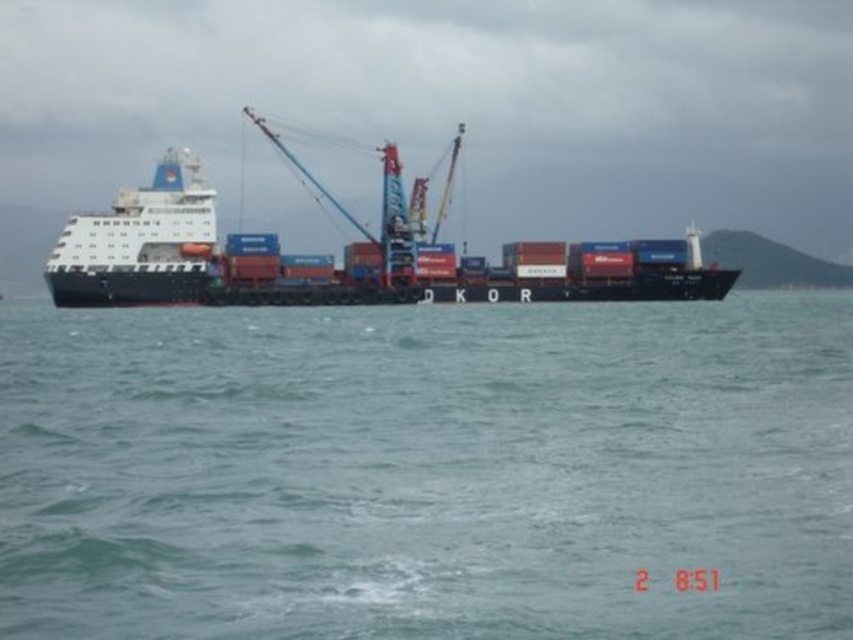
You are a sailor on the deck of the ship and looking straight ahead. Which object is closer to you between the blue water at center and the black matte container ship at center?

The blue water at center is closer to you because it is in front of the black matte container ship at center.

You are a seagull flying near the black matte container ship at center and the white glossy cruise ship at upper left. You want to land on the closest ship to rest. Which ship should you choose?

The black matte container ship at center is closer to the white glossy cruise ship at upper left by 10.80 meters, so you should land on the black matte container ship at center since it is nearer.